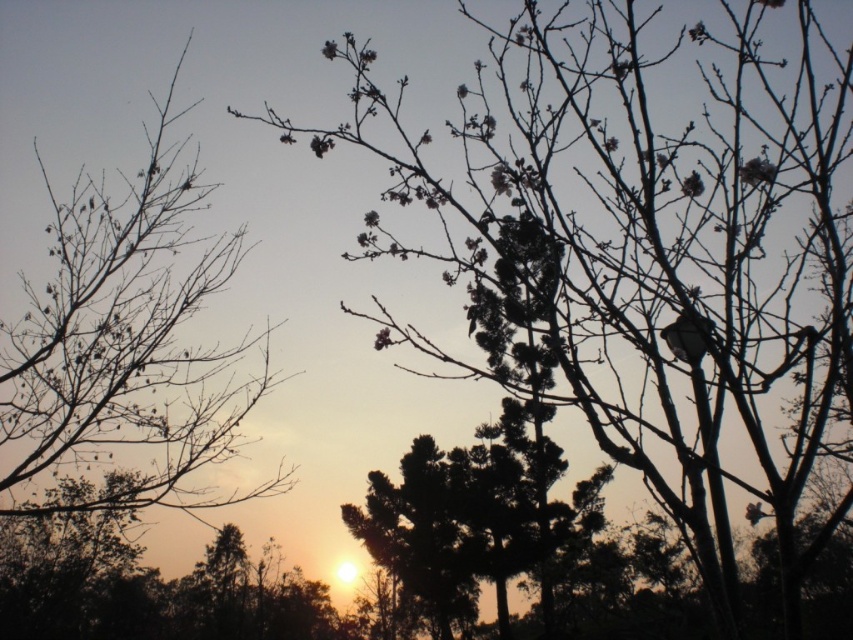
You are standing in the middle of a path and see the silvery branches at center and the silhouette bark tree at left. Which object is located above the other?

The silvery branches at center is positioned over the silhouette bark tree at left.

You are a painter standing at the edge of the scene wanting to paint both the silvery branches at center and the silhouette bark tree at left. If your canvas can only capture objects within a 5 meter range, will you be able to include both in your painting?

The silvery branches at center and the silhouette bark tree at left are 4.23 meters apart from each other. Since the distance between them is less than 5 meters, you can include both in your painting as they are within the 5 meter range.

You are an artist wanting to paint the sunset scene. You have two trees in your viewfinder. The silvery branches at center and the silhouette bark tree at left. Which tree should you focus on if you want to capture the wider tree in your painting?

The silvery branches at center should be focused on because its width is larger than the silhouette bark tree at left.